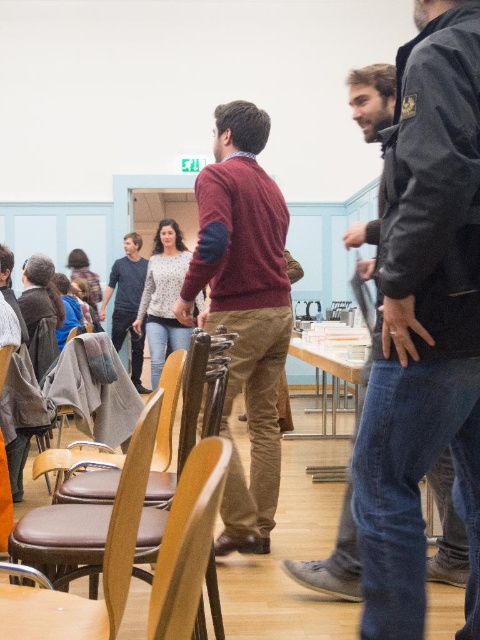
You are organizing a workshop in this room and need to ensure there is enough space for participants. Given the maroon sweater at center and the wooden table at center, which object takes up more space in the room?

The maroon sweater at center is larger in size than the wooden table at center, so it takes up more space in the room.

You are organizing a workshop and need to arrange materials. You have a dark gray jacket at right and a speckled sweater at center. Which item should you move to the left to make space for a new display board?

The dark gray jacket at right is on the right side of the speckled sweater at center. To make space for the display board, move the dark gray jacket at right to the left so it is no longer blocking the right side of the speckled sweater at center.

Looking at this image, you are standing at the entrance of the room and want to reach the point marked as point (267, 310). There is an obstacle at point (348, 369). Will you encounter this obstacle on your way?

Point (267, 310) is in front of point (348, 369), so you will encounter the obstacle at point (348, 369) on your way to point (267, 310).